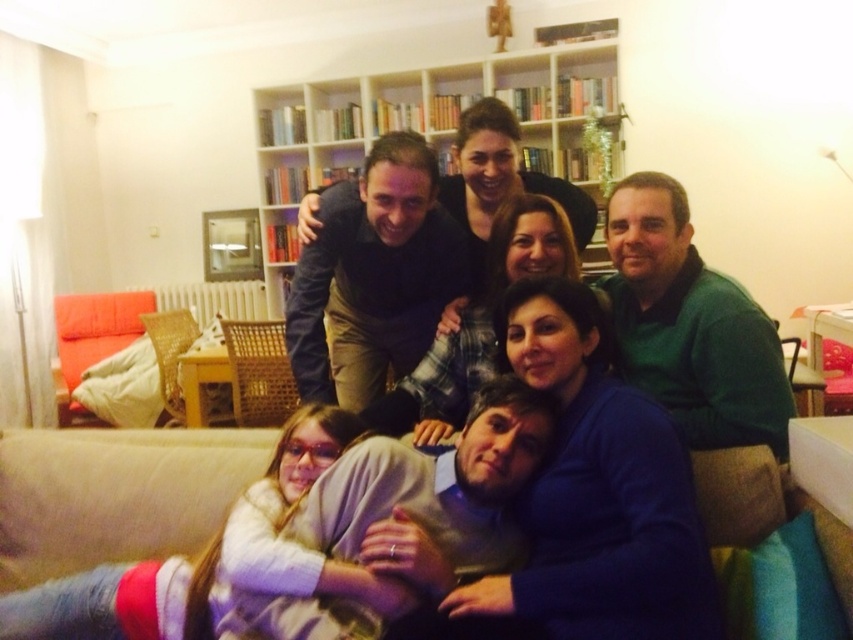
Can you confirm if beige fabric couch at lower center is bigger than wooden bookshelf at upper center?

No, beige fabric couch at lower center is not bigger than wooden bookshelf at upper center.

Does beige fabric couch at lower center come in front of wooden bookshelf at upper center?

Yes.

What are the coordinates of `beige fabric couch at lower center` in the screenshot? It's located at (115, 493).